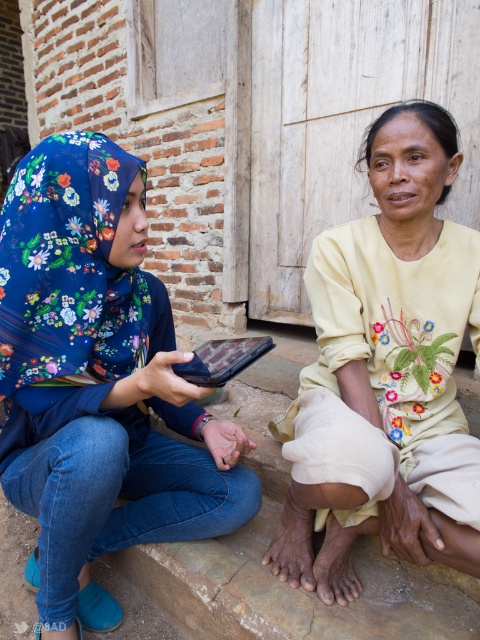
Based on the photo, between floral fabric hijab at left and beige embroidered dress at center, which one has more height?

floral fabric hijab at left is taller.

Is floral fabric hijab at left taller than beige embroidered dress at center?

Indeed, floral fabric hijab at left has a greater height compared to beige embroidered dress at center.

Is point (85, 184) positioned behind point (381, 324)?

No, (85, 184) is in front of (381, 324).

Where is `floral fabric hijab at left`? Image resolution: width=480 pixels, height=640 pixels. floral fabric hijab at left is located at coordinates (98, 381).

Does beige embroidered dress at center have a lesser height compared to matte black tablet at center?

Incorrect, beige embroidered dress at center's height does not fall short of matte black tablet at center's.

Is beige embroidered dress at center closer to camera compared to matte black tablet at center?

No, it is behind matte black tablet at center.

Does point (354, 288) lie behind point (215, 376)?

Yes, it is behind point (215, 376).

Find the location of a particular element. This screenshot has width=480, height=640. beige embroidered dress at center is located at coordinates (387, 358).

Which of these two, floral fabric hijab at left or matte black tablet at center, stands shorter?

Standing shorter between the two is matte black tablet at center.

Is floral fabric hijab at left below matte black tablet at center?

Yes, floral fabric hijab at left is below matte black tablet at center.

Does point (29, 269) come closer to viewer compared to point (215, 340)?

Yes.

The width and height of the screenshot is (480, 640). I want to click on floral fabric hijab at left, so click(x=98, y=381).